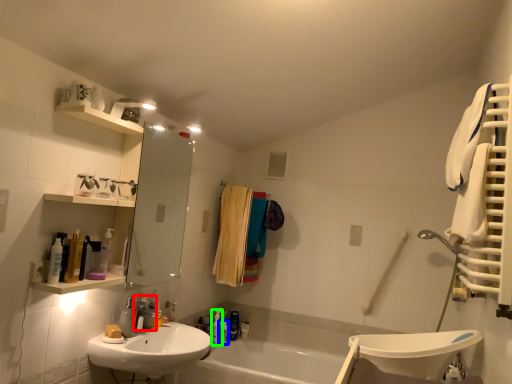
Question: Considering the real-world distances, which object is farthest from plumbing fixture (highlighted by a red box)? toiletry (highlighted by a blue box) or toiletry (highlighted by a green box)?

Choices:
 (A) toiletry
 (B) toiletry

Answer: (A)